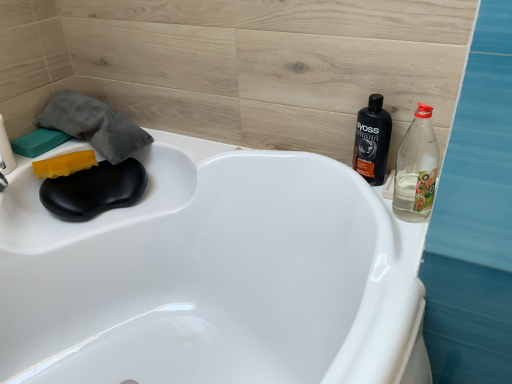
The image size is (512, 384). Identify the location of clear plastic bottle at right, which is counted as the first bottle, starting from the front. (416, 169).

The width and height of the screenshot is (512, 384). Identify the location of yellow sponge at left, acting as the 2th soap starting from the left. (64, 164).

I want to click on green sponge at upper left, the first soap positioned from the left, so [x=38, y=142].

Choose the correct answer: Is black plastic bottle at upper right, the 1th bottle when ordered from back to front, inside clear plastic bottle at right, the 2th bottle when ordered from back to front, or outside it?

black plastic bottle at upper right, the 1th bottle when ordered from back to front, is outside clear plastic bottle at right, the 2th bottle when ordered from back to front.

Does black plastic bottle at upper right, which is counted as the 2th bottle, starting from the front, touch clear plastic bottle at right, which is counted as the first bottle, starting from the front?

Yes, black plastic bottle at upper right, which is counted as the 2th bottle, starting from the front, is right next to clear plastic bottle at right, which is counted as the first bottle, starting from the front, and making contact.

Does point (357, 140) appear closer or farther from the camera than point (414, 213)?

Point (357, 140) is farther from the camera than point (414, 213).

Find the location of a particular element. The image size is (512, 384). bottle located on the right of black plastic bottle at upper right, which is counted as the 2th bottle, starting from the front is located at coordinates (416, 169).

Which object is closer to the camera taking this photo, green sponge at upper left, the first soap positioned from the left, or clear plastic bottle at right, the 2th bottle when ordered from back to front?

clear plastic bottle at right, the 2th bottle when ordered from back to front, is closer to the camera.

Which of these two, green sponge at upper left, the first soap positioned from the left, or clear plastic bottle at right, which is counted as the first bottle, starting from the front, is thinner?

clear plastic bottle at right, which is counted as the first bottle, starting from the front, is thinner.

From the image's perspective, is green sponge at upper left, the 2th soap viewed from the right, below clear plastic bottle at right, which is counted as the first bottle, starting from the front?

Incorrect, from the image's perspective, green sponge at upper left, the 2th soap viewed from the right, is higher than clear plastic bottle at right, which is counted as the first bottle, starting from the front.

From a real-world perspective, between green sponge at upper left, the first soap positioned from the left, and clear plastic bottle at right, which is counted as the first bottle, starting from the front, who is vertically higher?

clear plastic bottle at right, which is counted as the first bottle, starting from the front.

Can you confirm if green sponge at upper left, the first soap positioned from the left, is shorter than yellow sponge at left, acting as the first soap starting from the right?

Yes, green sponge at upper left, the first soap positioned from the left, is shorter than yellow sponge at left, acting as the first soap starting from the right.

Is green sponge at upper left, the 2th soap viewed from the right, situated inside yellow sponge at left, acting as the 2th soap starting from the left, or outside?

green sponge at upper left, the 2th soap viewed from the right, is not enclosed by yellow sponge at left, acting as the 2th soap starting from the left.

Does green sponge at upper left, the 2th soap viewed from the right, appear on the left side of yellow sponge at left, acting as the first soap starting from the right?

Yes, green sponge at upper left, the 2th soap viewed from the right, is to the left of yellow sponge at left, acting as the first soap starting from the right.

From the image's perspective, is green sponge at upper left, the first soap positioned from the left, located above or below yellow sponge at left, acting as the 2th soap starting from the left?

Clearly, from the image's perspective, green sponge at upper left, the first soap positioned from the left, is above yellow sponge at left, acting as the 2th soap starting from the left.

Could you measure the distance between black plastic bottle at upper right, the 1th bottle when ordered from back to front, and green sponge at upper left, the first soap positioned from the left?

black plastic bottle at upper right, the 1th bottle when ordered from back to front, is 35.30 inches away from green sponge at upper left, the first soap positioned from the left.

Looking at this image, from a real-world perspective, is black plastic bottle at upper right, the 1th bottle when ordered from back to front, above or below green sponge at upper left, the first soap positioned from the left?

black plastic bottle at upper right, the 1th bottle when ordered from back to front, is situated higher than green sponge at upper left, the first soap positioned from the left, in the real world.

Is black plastic bottle at upper right, the 1th bottle when ordered from back to front, next to green sponge at upper left, the 2th soap viewed from the right?

They are not placed beside each other.

Which is behind, point (358, 128) or point (61, 137)?

The point (61, 137) is farther.

Between clear plastic bottle at right, the 2th bottle when ordered from back to front, and black plastic bottle at upper right, which is counted as the 2th bottle, starting from the front, which one has larger size?

clear plastic bottle at right, the 2th bottle when ordered from back to front.

Is clear plastic bottle at right, which is counted as the first bottle, starting from the front, facing towards black plastic bottle at upper right, the 1th bottle when ordered from back to front?

No.

Is clear plastic bottle at right, which is counted as the first bottle, starting from the front, inside the boundaries of black plastic bottle at upper right, which is counted as the 2th bottle, starting from the front, or outside?

clear plastic bottle at right, which is counted as the first bottle, starting from the front, lies outside black plastic bottle at upper right, which is counted as the 2th bottle, starting from the front.

Looking at this image, which object is further away from the camera, clear plastic bottle at right, the 2th bottle when ordered from back to front, or green sponge at upper left, the first soap positioned from the left?

green sponge at upper left, the first soap positioned from the left, is further from the camera.

Is clear plastic bottle at right, the 2th bottle when ordered from back to front, to the left or to the right of green sponge at upper left, the 2th soap viewed from the right, in the image?

In the image, clear plastic bottle at right, the 2th bottle when ordered from back to front, appears on the right side of green sponge at upper left, the 2th soap viewed from the right.

Is clear plastic bottle at right, the 2th bottle when ordered from back to front, taller than green sponge at upper left, the first soap positioned from the left?

Yes, clear plastic bottle at right, the 2th bottle when ordered from back to front, is taller than green sponge at upper left, the first soap positioned from the left.

Is clear plastic bottle at right, which is counted as the first bottle, starting from the front, positioned with its back to green sponge at upper left, the 2th soap viewed from the right?

clear plastic bottle at right, which is counted as the first bottle, starting from the front, is not turned away from green sponge at upper left, the 2th soap viewed from the right.

Between yellow sponge at left, acting as the first soap starting from the right, and green sponge at upper left, the 2th soap viewed from the right, which one has smaller width?

With smaller width is green sponge at upper left, the 2th soap viewed from the right.

Is yellow sponge at left, acting as the 2th soap starting from the left, situated inside green sponge at upper left, the 2th soap viewed from the right, or outside?

yellow sponge at left, acting as the 2th soap starting from the left, is outside green sponge at upper left, the 2th soap viewed from the right.

Where is `soap above the yellow sponge at left, acting as the first soap starting from the right (from the image's perspective)`? This screenshot has width=512, height=384. soap above the yellow sponge at left, acting as the first soap starting from the right (from the image's perspective) is located at coordinates (38, 142).

Measure the distance from yellow sponge at left, acting as the first soap starting from the right, to green sponge at upper left, the first soap positioned from the left.

4.02 inches.

Locate an element on the screen. The width and height of the screenshot is (512, 384). bottle below the black plastic bottle at upper right, which is counted as the 2th bottle, starting from the front (from the image's perspective) is located at coordinates (416, 169).

Which soap is the 2nd one when counting from the back of the clear plastic bottle at right, the 2th bottle when ordered from back to front? Please provide its 2D coordinates.

[(38, 142)]

From the picture: Considering their positions, is yellow sponge at left, acting as the first soap starting from the right, positioned further to green sponge at upper left, the first soap positioned from the left, than clear plastic bottle at right, the 2th bottle when ordered from back to front?

The object further to green sponge at upper left, the first soap positioned from the left, is clear plastic bottle at right, the 2th bottle when ordered from back to front.

In the scene shown: Considering their positions, is green sponge at upper left, the 2th soap viewed from the right, positioned further to yellow sponge at left, acting as the 2th soap starting from the left, than clear plastic bottle at right, which is counted as the first bottle, starting from the front?

clear plastic bottle at right, which is counted as the first bottle, starting from the front, lies further to yellow sponge at left, acting as the 2th soap starting from the left, than the other object.

From the image, which object appears to be nearer to black plastic bottle at upper right, the 1th bottle when ordered from back to front, green sponge at upper left, the first soap positioned from the left, or clear plastic bottle at right, which is counted as the first bottle, starting from the front?

clear plastic bottle at right, which is counted as the first bottle, starting from the front.

When comparing their distances from yellow sponge at left, acting as the 2th soap starting from the left, does green sponge at upper left, the first soap positioned from the left, or black plastic bottle at upper right, which is counted as the 2th bottle, starting from the front, seem further?

black plastic bottle at upper right, which is counted as the 2th bottle, starting from the front.

When comparing their distances from yellow sponge at left, acting as the first soap starting from the right, does clear plastic bottle at right, which is counted as the first bottle, starting from the front, or green sponge at upper left, the 2th soap viewed from the right, seem closer?

green sponge at upper left, the 2th soap viewed from the right, lies closer to yellow sponge at left, acting as the first soap starting from the right, than the other object.

Looking at the image, which one is located closer to black plastic bottle at upper right, which is counted as the 2th bottle, starting from the front, yellow sponge at left, acting as the first soap starting from the right, or clear plastic bottle at right, the 2th bottle when ordered from back to front?

Based on the image, clear plastic bottle at right, the 2th bottle when ordered from back to front, appears to be nearer to black plastic bottle at upper right, which is counted as the 2th bottle, starting from the front.

Looking at the image, which one is located further to clear plastic bottle at right, the 2th bottle when ordered from back to front, yellow sponge at left, acting as the 2th soap starting from the left, or black plastic bottle at upper right, the 1th bottle when ordered from back to front?

Based on the image, yellow sponge at left, acting as the 2th soap starting from the left, appears to be further to clear plastic bottle at right, the 2th bottle when ordered from back to front.

When comparing their distances from green sponge at upper left, the first soap positioned from the left, does black plastic bottle at upper right, which is counted as the 2th bottle, starting from the front, or clear plastic bottle at right, the 2th bottle when ordered from back to front, seem closer?

black plastic bottle at upper right, which is counted as the 2th bottle, starting from the front, is positioned closer to the anchor green sponge at upper left, the first soap positioned from the left.

Where is `bottle situated between yellow sponge at left, acting as the 2th soap starting from the left, and clear plastic bottle at right, the 2th bottle when ordered from back to front, from left to right`? This screenshot has width=512, height=384. bottle situated between yellow sponge at left, acting as the 2th soap starting from the left, and clear plastic bottle at right, the 2th bottle when ordered from back to front, from left to right is located at coordinates (372, 141).

Image resolution: width=512 pixels, height=384 pixels. I want to click on soap between green sponge at upper left, the 2th soap viewed from the right, and clear plastic bottle at right, which is counted as the first bottle, starting from the front, in the horizontal direction, so click(x=64, y=164).

I want to click on bottle between green sponge at upper left, the first soap positioned from the left, and clear plastic bottle at right, the 2th bottle when ordered from back to front, so click(372, 141).

At what (x,y) coordinates should I click in order to perform the action: click on soap situated between green sponge at upper left, the first soap positioned from the left, and black plastic bottle at upper right, the 1th bottle when ordered from back to front, from left to right. Please return your answer as a coordinate pair (x, y). This screenshot has height=384, width=512. Looking at the image, I should click on (64, 164).